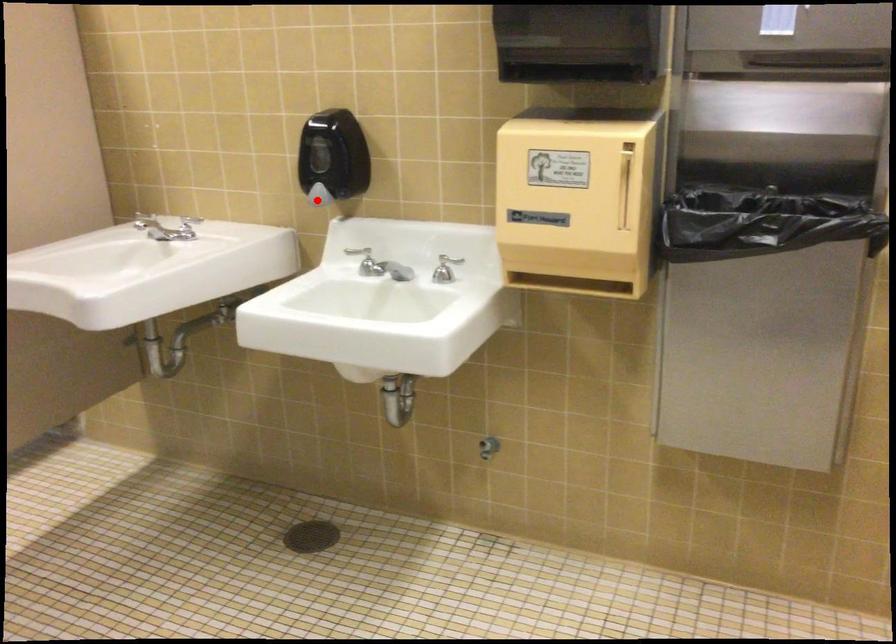
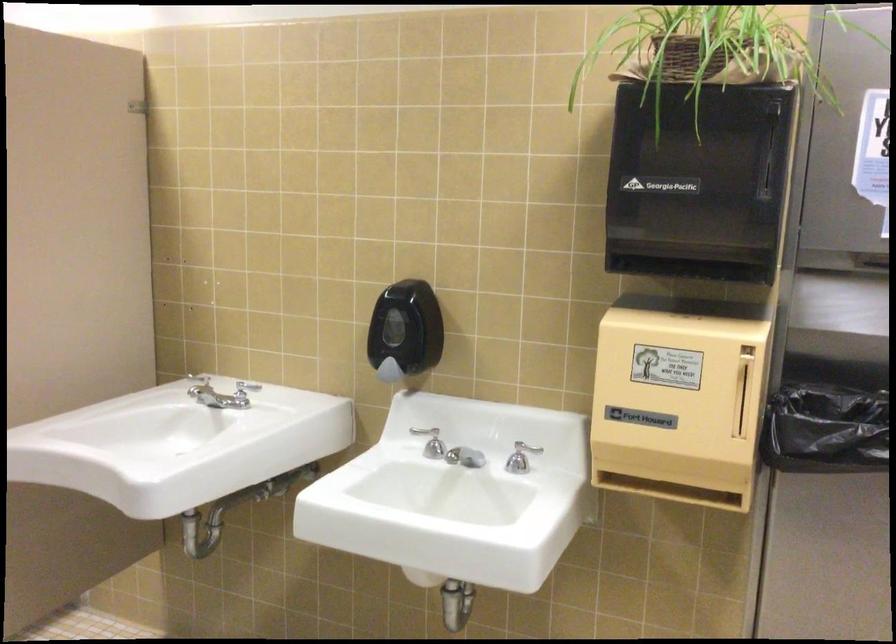
The point at the highlighted location is marked in the first image. Where is the corresponding point in the second image?

(389, 371)